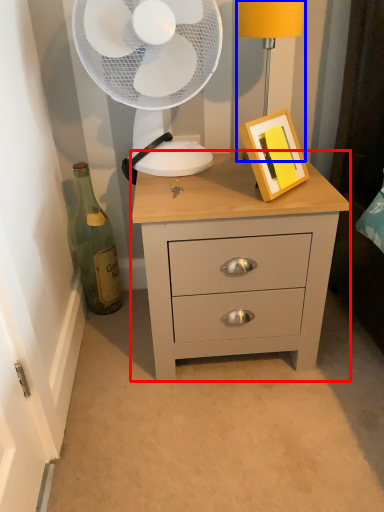
Question: Which object is closer to the camera taking this photo, chest of drawers (highlighted by a red box) or bedside lamp (highlighted by a blue box)?

Choices:
 (A) chest of drawers
 (B) bedside lamp

Answer: (A)